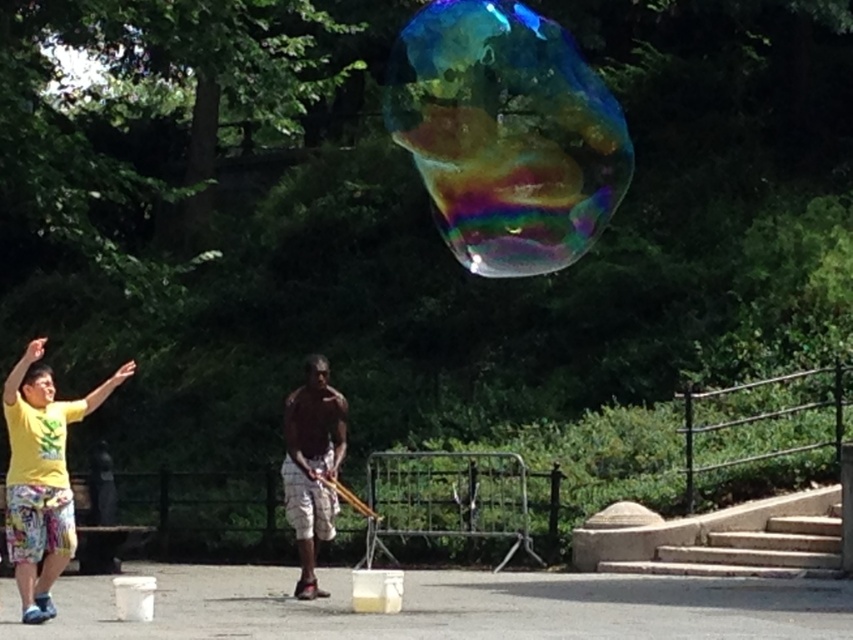
You are a photographer standing at the center of the park. You want to take a photo of the yellow cotton shirt at left and the matte brown shorts at center. Given that your camera has a maximum focus range of 5 meters, can you capture both subjects clearly in the same frame?

The distance between the yellow cotton shirt at left and the matte brown shorts at center is 4.58 meters, which is within the camera maximum focus range of 5 meters. Therefore, both subjects can be captured clearly in the same frame.

You are a photographer trying to capture the rainbow iridescent bubble at upper center and the yellow cotton shirt at left in the same frame. Based on their positions, which object is closer to the camera?

The rainbow iridescent bubble at upper center is positioned over the yellow cotton shirt at left, meaning it is closer to the camera than the shirt.

You are a photographer trying to capture the rainbow iridescent bubble at upper center and the yellow cotton shirt at left in a single shot. Based on their sizes, which object should you focus on first to ensure both are in frame?

The rainbow iridescent bubble at upper center has a smaller size compared to the yellow cotton shirt at left. To ensure both are in frame, focus on the smaller bubble first to adjust the camera angle and distance properly, then include the larger shirt.